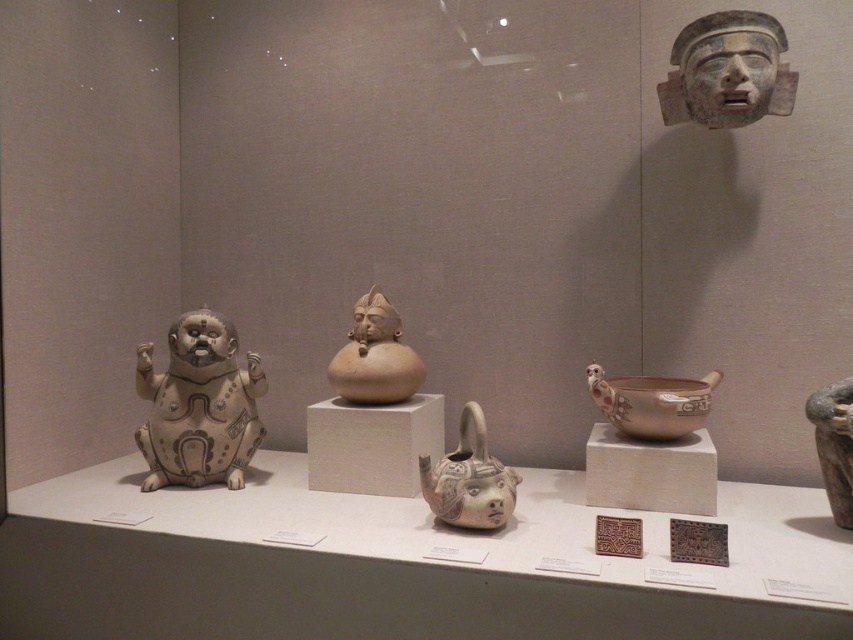
Can you confirm if white matte figurine at left is positioned below gray stone mask at upper right?

Indeed, white matte figurine at left is positioned under gray stone mask at upper right.

Does white matte figurine at left appear on the right side of gray stone mask at upper right?

In fact, white matte figurine at left is to the left of gray stone mask at upper right.

Is point (219, 385) in front of point (759, 44)?

No, it is not.

At what (x,y) coordinates should I click in order to perform the action: click on white matte figurine at left. Please return your answer as a coordinate pair (x, y). Looking at the image, I should click on (199, 404).

Can you confirm if white matte figurine at left is positioned to the right of matte clay figure at center?

Incorrect, white matte figurine at left is not on the right side of matte clay figure at center.

Which is below, white matte figurine at left or matte clay figure at center?

white matte figurine at left is below.

Which is in front, point (229, 456) or point (381, 392)?

Point (381, 392) is more forward.

Locate an element on the screen. The height and width of the screenshot is (640, 853). white matte figurine at left is located at coordinates (199, 404).

From the picture: Which is above, matte clay figure at center or brown matte vase at right?

matte clay figure at center is above.

Does point (370, 349) come farther from viewer compared to point (848, 516)?

Yes, it is.

Which is behind, point (395, 317) or point (834, 506)?

Point (395, 317)

This screenshot has width=853, height=640. What are the coordinates of `matte clay figure at center` in the screenshot? It's located at (375, 356).